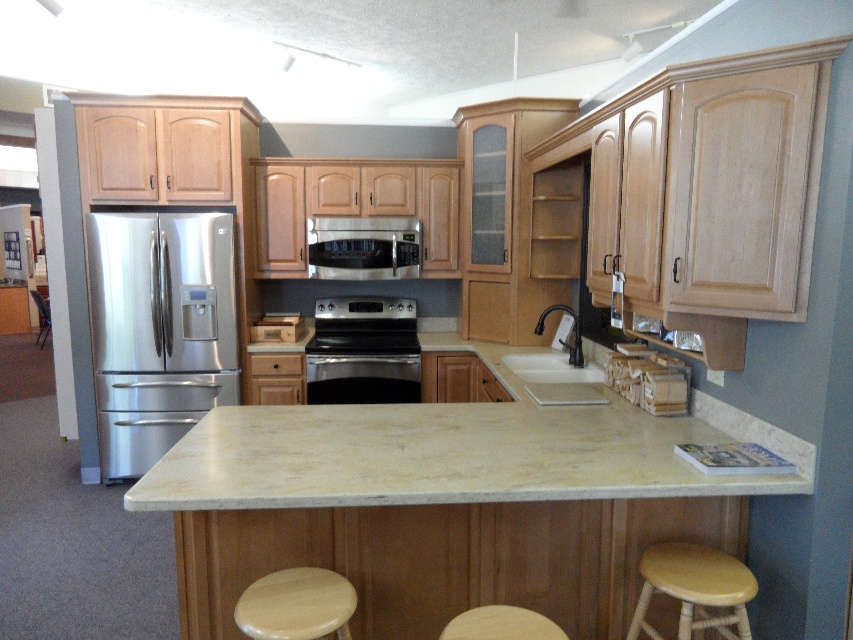
You are standing in a modern kitchen and want to reach a specific point in the kitchen. The point you need to reach is located at coordinates point (727, 588). Given that you are currently 6.53 feet away from this point, can you estimate how far you need to move forward to reach it?

You need to move forward 6.53 feet to reach the point (727, 588) since that is the distance between you and the point.

You are a kitchen designer planning to place a new dishwasher between the stainless steel refrigerator at left and the white matte sink at center. Based on their current positions, which side of the dishwasher should be closer to the refrigerator?

The stainless steel refrigerator at left is positioned on the left side of the white matte sink at center, so the dishwasher should be placed between them with its left side closer to the refrigerator.

You are in a kitchen with a light wood cabinetry and a stainless steel refrigerator on the left. You see a point marked at coordinates (694, 588). What object is located at this point?

The point at coordinates (694, 588) indicates a light wood wooden stool at lower right.